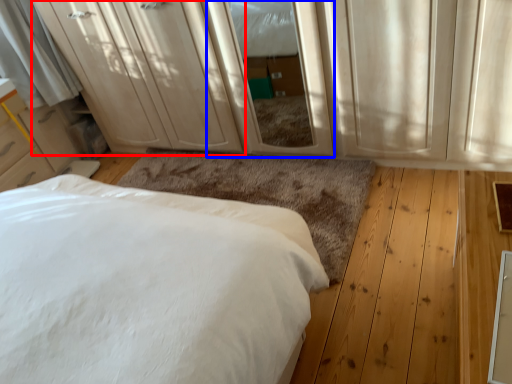
Question: Which point is further to the camera, dresser (highlighted by a red box) or screen door (highlighted by a blue box)?

Choices:
 (A) dresser
 (B) screen door

Answer: (A)